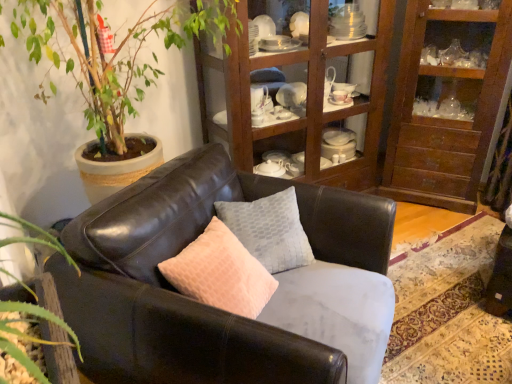
Question: Considering the relative positions of matte leather couch at center and wooden cabinet at upper center in the image provided, is matte leather couch at center in front of wooden cabinet at upper center?

Choices:
 (A) no
 (B) yes

Answer: (B)

Question: From the image's perspective, is matte leather couch at center located beneath wooden cabinet at upper center?

Choices:
 (A) no
 (B) yes

Answer: (B)

Question: Are matte leather couch at center and wooden cabinet at upper center far apart?

Choices:
 (A) yes
 (B) no

Answer: (A)

Question: Is matte leather couch at center facing towards wooden cabinet at upper center?

Choices:
 (A) no
 (B) yes

Answer: (A)

Question: Considering the relative sizes of matte leather couch at center and wooden cabinet at upper center in the image provided, is matte leather couch at center shorter than wooden cabinet at upper center?

Choices:
 (A) no
 (B) yes

Answer: (B)

Question: Does matte leather couch at center have a greater width compared to wooden cabinet at upper center?

Choices:
 (A) yes
 (B) no

Answer: (A)

Question: Could you tell me if textured gray pillow at center is facing wooden cabinet at upper right?

Choices:
 (A) no
 (B) yes

Answer: (A)

Question: Can you confirm if textured gray pillow at center is taller than wooden cabinet at upper right?

Choices:
 (A) yes
 (B) no

Answer: (B)

Question: Does textured gray pillow at center lie in front of wooden cabinet at upper right?

Choices:
 (A) no
 (B) yes

Answer: (B)

Question: Is textured gray pillow at center with wooden cabinet at upper right?

Choices:
 (A) no
 (B) yes

Answer: (A)

Question: Is textured gray pillow at center smaller than wooden cabinet at upper right?

Choices:
 (A) yes
 (B) no

Answer: (A)

Question: Is textured gray pillow at center wider than wooden cabinet at upper right?

Choices:
 (A) yes
 (B) no

Answer: (B)

Question: Considering the relative sizes of wooden cabinet at upper right and textured gray pillow at center in the image provided, is wooden cabinet at upper right taller than textured gray pillow at center?

Choices:
 (A) no
 (B) yes

Answer: (B)